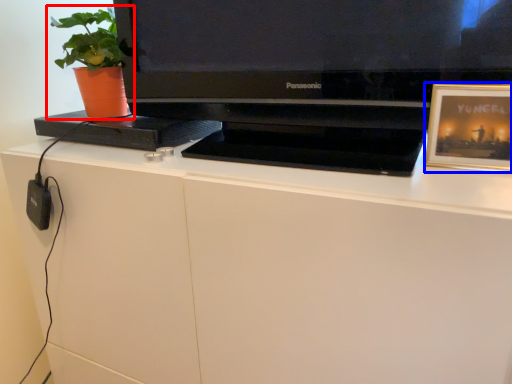
Question: Which object is further to the camera taking this photo, houseplant (highlighted by a red box) or picture frame (highlighted by a blue box)?

Choices:
 (A) houseplant
 (B) picture frame

Answer: (A)